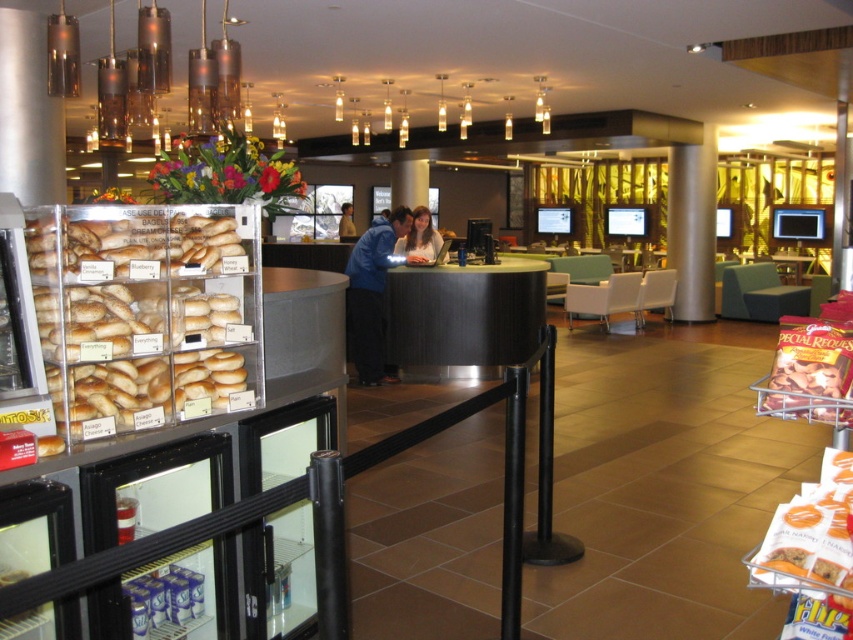
You are standing in the modern cafe and need to reach the bagel display case located at point (x=358, y=280). Can you estimate how far you need to walk to get there?

The distance between you and the bagel display case at point (x=358, y=280) is 6.99 meters, so you need to walk approximately 7 meters to reach it.

You are a customer standing in the modern cafe and see both the matte blue shirt at center and the blue fabric shirt at center. Which shirt is positioned closer to you?

The matte blue shirt at center is closer to the viewer than the blue fabric shirt at center.

You are a customer at the modern cafe and you want to choose a shirt from the two available at the center. The matte blue shirt at center and the blue fabric shirt at center. Which one is smaller in size?

The matte blue shirt at center is smaller than the blue fabric shirt at center.